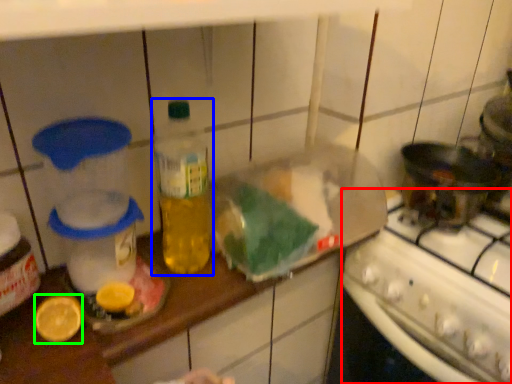
Question: Which is farther away from stove (highlighted by a red box)? bottle (highlighted by a blue box) or lemon (highlighted by a green box)?

Choices:
 (A) bottle
 (B) lemon

Answer: (B)